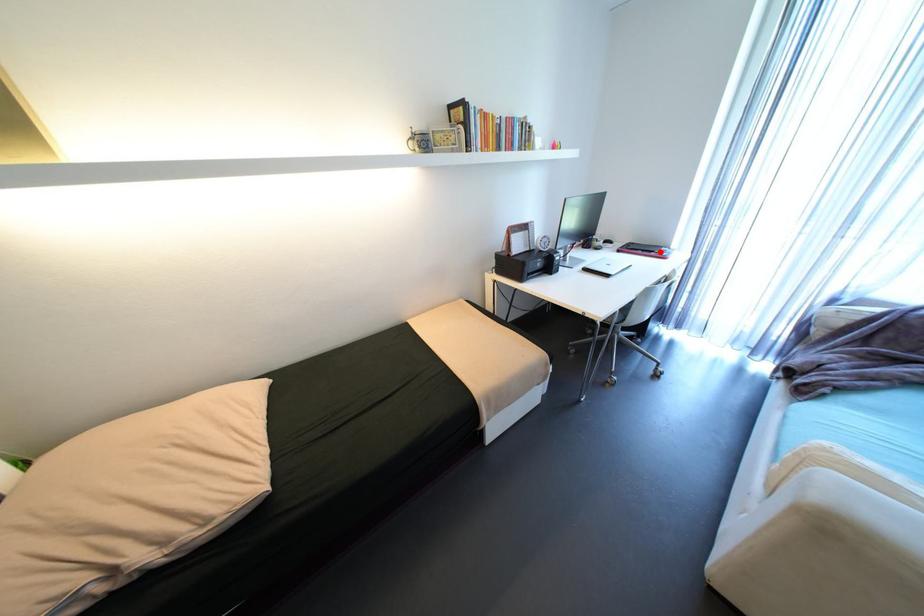
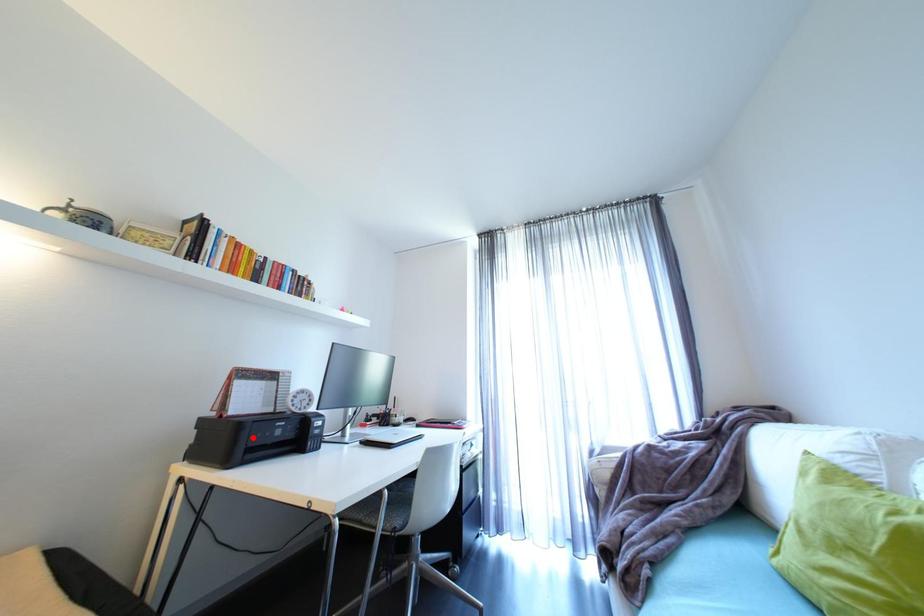
I am providing you with two images of the same scene from different viewpoints. A red point is marked on the first image and another point is marked on the second image. Is the red point in image1 aligned with the point shown in image2?

No